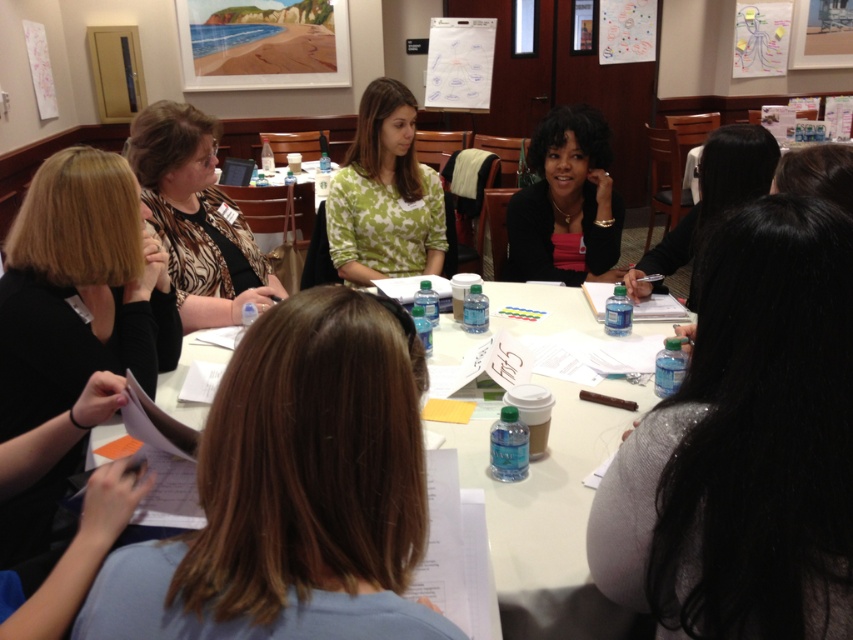
You are a photographer trying to capture a group photo of the people around the table. You want to ensure that both the black matte hair at left and the white paperboard at upper center are clearly visible in the frame. Given their sizes, which object should you prioritize positioning closer to the camera to ensure clarity?

The black matte hair at left is larger in size compared to the white paperboard at upper center. To ensure clarity, prioritize positioning the black matte hair at left closer to the camera since its larger size may require more focus and detail to capture effectively.

You are a new attendee entering the conference room and want to sit next to the black matte hair at left. Which side of the white paperboard at upper center should you sit on?

You should sit to the left side of the white paperboard at upper center because the black matte hair at left is located to the left of it.